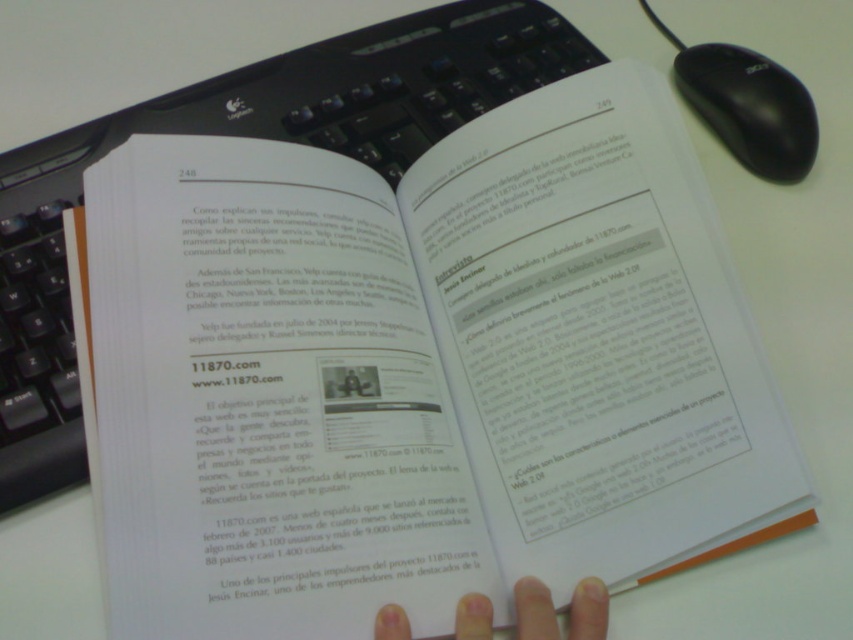
Between black matte mouse at upper right and white matte finger at lower center, which one is positioned lower?

Positioned lower is white matte finger at lower center.

Looking at this image, can you confirm if black matte mouse at upper right is positioned below white matte finger at lower center?

Actually, black matte mouse at upper right is above white matte finger at lower center.

Describe the element at coordinates (750, 108) in the screenshot. The height and width of the screenshot is (640, 853). I see `black matte mouse at upper right` at that location.

Identify the location of black matte mouse at upper right. The image size is (853, 640). (750, 108).